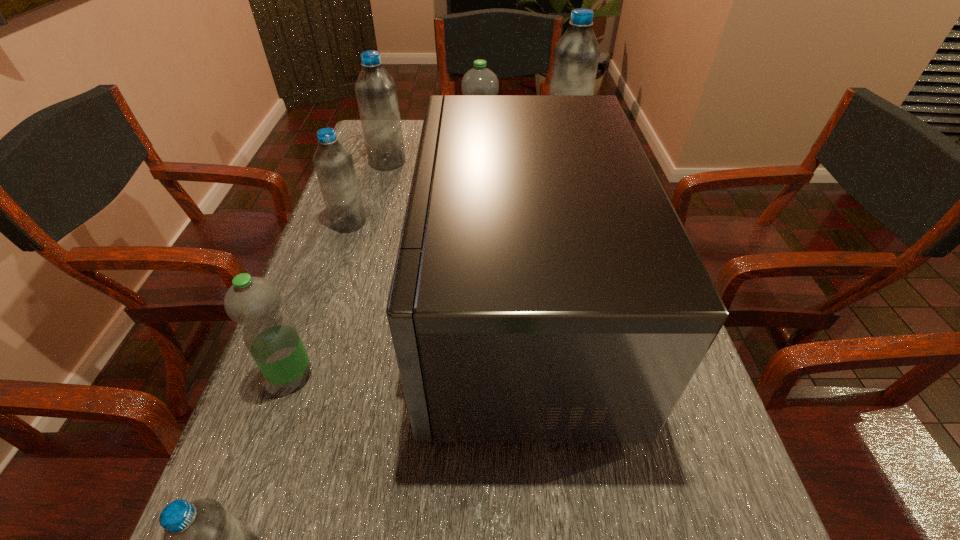
Where is `object located at the far left corner`? The width and height of the screenshot is (960, 540). object located at the far left corner is located at coordinates (375, 89).

I want to click on object at the far right corner, so click(576, 55).

Locate an element on the screen. The width and height of the screenshot is (960, 540). vacant space at the left edge is located at coordinates (332, 446).

Locate an element on the screen. This screenshot has width=960, height=540. free area in between the second farthest blue water bottle and the smaller green water bottle is located at coordinates (340, 268).

Identify which object is the fifth closest to the second farthest blue water bottle. Please provide its 2D coordinates. Your answer should be formatted as a tuple, i.e. [(x, y)], where the tuple contains the x and y coordinates of a point satisfying the conditions above.

[(270, 336)]

Identify which object is located as the second nearest to the fourth farthest water bottle. Please provide its 2D coordinates. Your answer should be formatted as a tuple, i.e. [(x, y)], where the tuple contains the x and y coordinates of a point satisfying the conditions above.

[(375, 89)]

Locate which water bottle is the fourth closest to the smallest blue water bottle. Please provide its 2D coordinates. Your answer should be formatted as a tuple, i.e. [(x, y)], where the tuple contains the x and y coordinates of a point satisfying the conditions above.

[(375, 89)]

Locate an element on the screen. The height and width of the screenshot is (540, 960). water bottle that is the third closest to the rightmost water bottle is located at coordinates [334, 166].

Identify which blue water bottle is the second closest to the microwave oven. Please provide its 2D coordinates. Your answer should be formatted as a tuple, i.e. [(x, y)], where the tuple contains the x and y coordinates of a point satisfying the conditions above.

[(202, 539)]

Select which blue water bottle is the closest to the farthest blue water bottle. Please provide its 2D coordinates. Your answer should be formatted as a tuple, i.e. [(x, y)], where the tuple contains the x and y coordinates of a point satisfying the conditions above.

[(375, 89)]